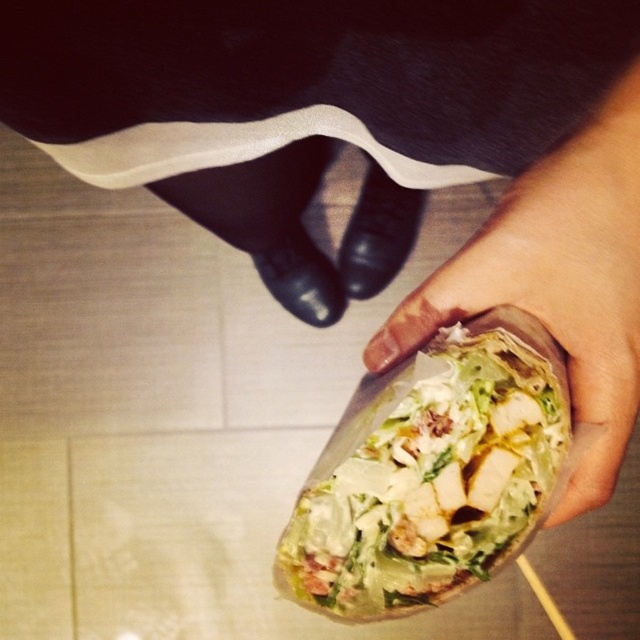
Question: From the image, what is the correct spatial relationship of green leafy salad at center in relation to translucent plastic wrap at lower right?

Choices:
 (A) right
 (B) left

Answer: (B)

Question: Does green leafy salad at center have a larger size compared to translucent plastic wrap at lower right?

Choices:
 (A) yes
 (B) no

Answer: (A)

Question: Among these objects, which one is nearest to the camera?

Choices:
 (A) green leafy salad at center
 (B) translucent plastic wrap at lower right

Answer: (B)

Question: Is green leafy salad at center positioned behind translucent plastic wrap at lower right?

Choices:
 (A) yes
 (B) no

Answer: (A)